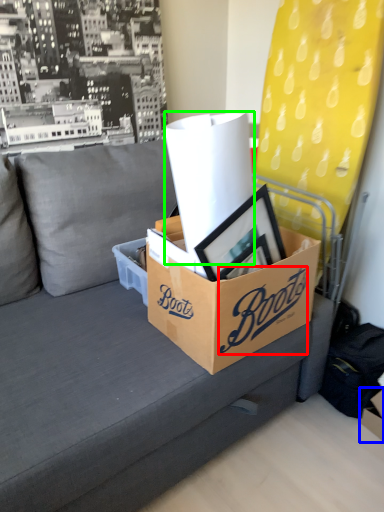
Question: Which object is positioned farthest from writing (highlighted by a red box)? Select from storage box (highlighted by a blue box) and paper towel (highlighted by a green box).

Choices:
 (A) storage box
 (B) paper towel

Answer: (A)